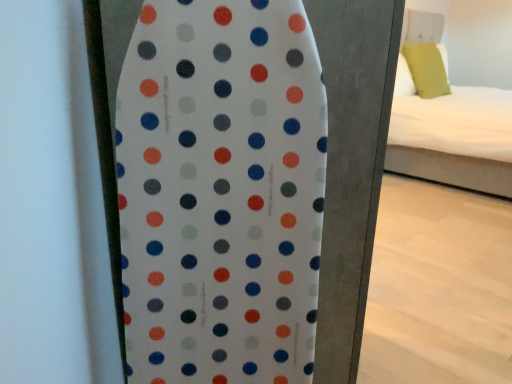
Question: Is white fabric bed at right taller than white dotted surfboard at center?

Choices:
 (A) yes
 (B) no

Answer: (A)

Question: Does white fabric bed at right contain white dotted surfboard at center?

Choices:
 (A) yes
 (B) no

Answer: (B)

Question: Considering the relative positions of white fabric bed at right and white dotted surfboard at center in the image provided, is white fabric bed at right to the right of white dotted surfboard at center from the viewer's perspective?

Choices:
 (A) no
 (B) yes

Answer: (B)

Question: Is white fabric bed at right smaller than white dotted surfboard at center?

Choices:
 (A) yes
 (B) no

Answer: (B)

Question: Can you confirm if white fabric bed at right is positioned to the left of white dotted surfboard at center?

Choices:
 (A) no
 (B) yes

Answer: (A)

Question: Is white dotted surfboard at center bigger or smaller than green fabric pillow at upper right?

Choices:
 (A) small
 (B) big

Answer: (B)

Question: Visually, is white dotted surfboard at center positioned to the left or to the right of green fabric pillow at upper right?

Choices:
 (A) right
 (B) left

Answer: (B)

Question: Is white dotted surfboard at center wider or thinner than green fabric pillow at upper right?

Choices:
 (A) thin
 (B) wide

Answer: (B)

Question: Would you say white dotted surfboard at center is inside or outside green fabric pillow at upper right?

Choices:
 (A) inside
 (B) outside

Answer: (B)

Question: Based on their sizes in the image, would you say white fabric bed at right is bigger or smaller than green fabric pillow at upper right?

Choices:
 (A) big
 (B) small

Answer: (A)

Question: Relative to green fabric pillow at upper right, is white fabric bed at right in front or behind?

Choices:
 (A) behind
 (B) front

Answer: (B)

Question: From a real-world perspective, is white fabric bed at right physically located above or below green fabric pillow at upper right?

Choices:
 (A) below
 (B) above

Answer: (A)

Question: Looking at their shapes, would you say white fabric bed at right is wider or thinner than green fabric pillow at upper right?

Choices:
 (A) thin
 (B) wide

Answer: (B)

Question: From the image's perspective, is white fabric bed at right above or below white dotted surfboard at center?

Choices:
 (A) above
 (B) below

Answer: (A)

Question: In the image, is white fabric bed at right positioned in front of or behind white dotted surfboard at center?

Choices:
 (A) front
 (B) behind

Answer: (B)